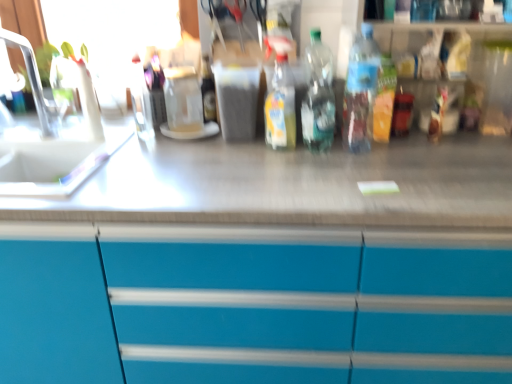
You are a GUI agent. You are given a task and a screenshot of the screen. Output one action in this format:
    pyautogui.click(x=<x>, y=<y>)
    Task: Click on the space that is in front of translucent plastic bottle at center, which ranks as the fourth bottle in left-to-right order
    This screenshot has width=512, height=384.
    Given the screenshot: What is the action you would take?
    pyautogui.click(x=359, y=175)